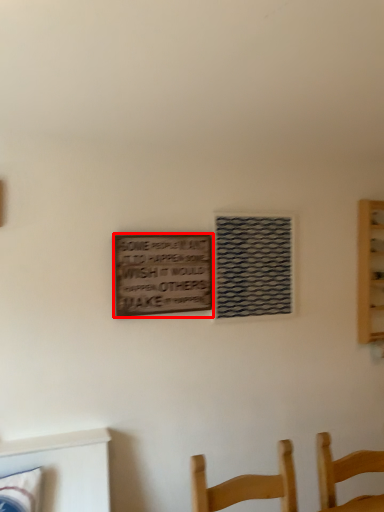
Question: From the image's perspective, where is plaque (annotated by the red box) located relative to window?

Choices:
 (A) above
 (B) below

Answer: (B)